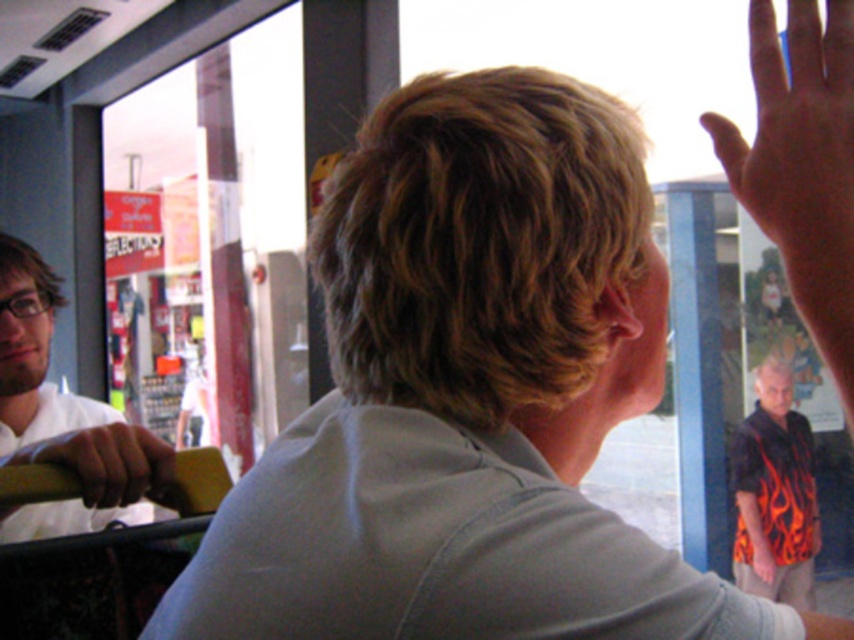
Question: Which of the following is the farthest from the observer?

Choices:
 (A) (28, 508)
 (B) (71, 432)

Answer: (A)

Question: Does flame-patterned shirt at right appear under wooden handle at lower left?

Choices:
 (A) no
 (B) yes

Answer: (B)

Question: Does flame-patterned shirt at right appear on the left side of wooden handle at lower left?

Choices:
 (A) yes
 (B) no

Answer: (B)

Question: Is skinny flesh at upper right below wooden handle at lower left?

Choices:
 (A) no
 (B) yes

Answer: (A)

Question: Considering the real-world distances, which object is closest to the white matte shirt at left?

Choices:
 (A) skinny flesh at upper right
 (B) flame-patterned shirt at right
 (C) wooden handle at lower left

Answer: (C)

Question: Considering the real-world distances, which object is farthest from the white matte shirt at left?

Choices:
 (A) wooden handle at lower left
 (B) flame-patterned shirt at right
 (C) skinny flesh at upper right

Answer: (B)